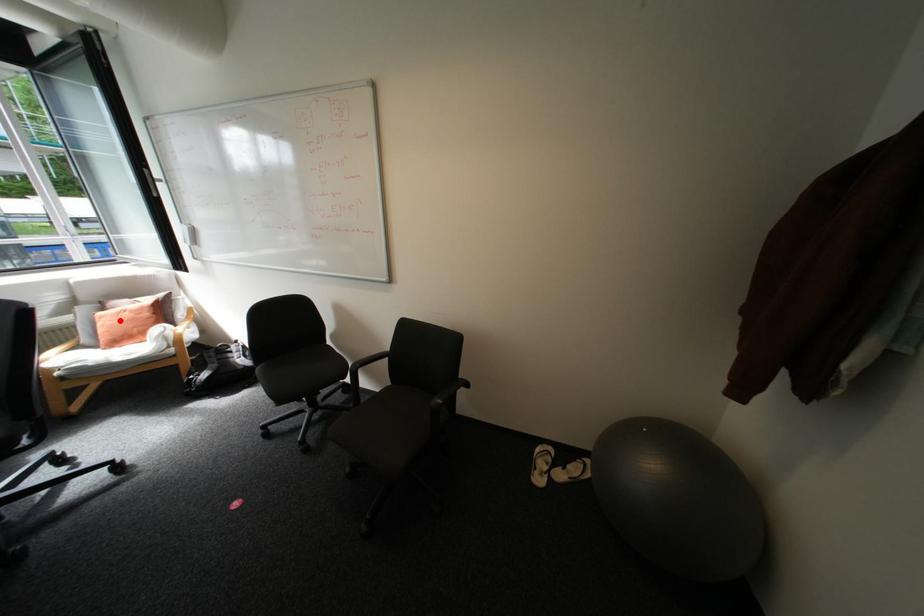
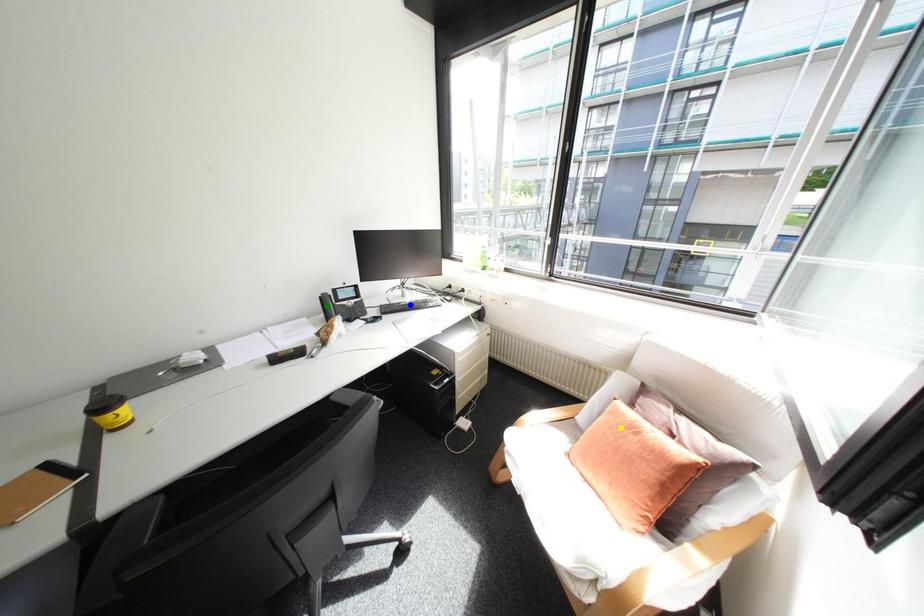
Question: I am providing you with two images of the same scene from different viewpoints. A red point is marked on the first image. You are given multiple points on the second image. Which point in image 2 represents the same 3d spot as the red point in image 1?

Choices:
 (A) yellow point
 (B) blue point
 (C) green point

Answer: (A)